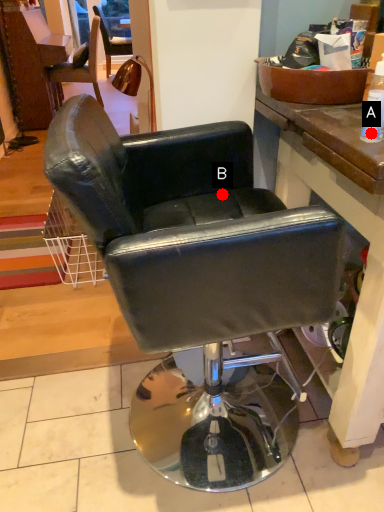
Question: Two points are circled on the image, labeled by A and B beside each circle. Which of the following is the closest to the observer?

Choices:
 (A) A is closer
 (B) B is closer

Answer: (A)